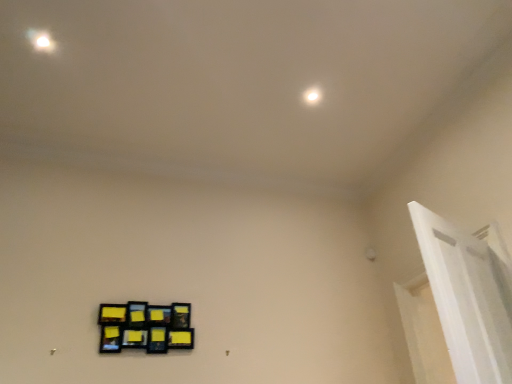
Question: Can you confirm if black matte picture frame at lower left is shorter than white glossy door frame at upper right?

Choices:
 (A) no
 (B) yes

Answer: (B)

Question: Is black matte picture frame at lower left aimed at white glossy door frame at upper right?

Choices:
 (A) yes
 (B) no

Answer: (B)

Question: From the image's perspective, would you say black matte picture frame at lower left is shown under white glossy door frame at upper right?

Choices:
 (A) yes
 (B) no

Answer: (A)

Question: From the image's perspective, is black matte picture frame at lower left located above white glossy door frame at upper right?

Choices:
 (A) yes
 (B) no

Answer: (B)

Question: Considering the relative sizes of black matte picture frame at lower left and white glossy door frame at upper right in the image provided, is black matte picture frame at lower left wider than white glossy door frame at upper right?

Choices:
 (A) yes
 (B) no

Answer: (B)

Question: Is point (131, 306) closer or farther from the camera than point (436, 218)?

Choices:
 (A) closer
 (B) farther

Answer: (B)

Question: Is black matte picture frame at lower left wider or thinner than white glossy door frame at upper right?

Choices:
 (A) wide
 (B) thin

Answer: (B)

Question: Is black matte picture frame at lower left bigger or smaller than white glossy door frame at upper right?

Choices:
 (A) big
 (B) small

Answer: (B)

Question: In terms of height, does black matte picture frame at lower left look taller or shorter compared to white glossy door frame at upper right?

Choices:
 (A) tall
 (B) short

Answer: (B)

Question: Considering the positions of point (309, 97) and point (457, 261), is point (309, 97) closer or farther from the camera than point (457, 261)?

Choices:
 (A) closer
 (B) farther

Answer: (B)

Question: From their relative heights in the image, would you say white glossy light at upper center is taller or shorter than white glossy door frame at upper right?

Choices:
 (A) short
 (B) tall

Answer: (A)

Question: Which is correct: white glossy light at upper center is inside white glossy door frame at upper right, or outside of it?

Choices:
 (A) outside
 (B) inside

Answer: (A)

Question: From a real-world perspective, is white glossy light at upper center physically located above or below white glossy door frame at upper right?

Choices:
 (A) below
 (B) above

Answer: (B)

Question: Considering the positions of black matte picture frame at lower left and white glossy light at upper center in the image, is black matte picture frame at lower left taller or shorter than white glossy light at upper center?

Choices:
 (A) tall
 (B) short

Answer: (A)

Question: Is black matte picture frame at lower left inside or outside of white glossy light at upper center?

Choices:
 (A) inside
 (B) outside

Answer: (B)